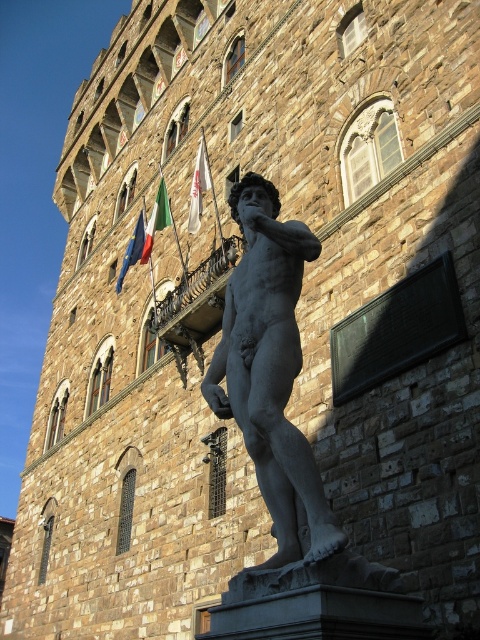
Question: Does green fabric flag at upper center come in front of blue fabric flag at upper left?

Choices:
 (A) no
 (B) yes

Answer: (B)

Question: Based on their relative distances, which object is farther from the white fabric flag at upper center?

Choices:
 (A) matte gray statue at center
 (B) green fabric flag at upper center

Answer: (A)

Question: Considering the real-world distances, which object is closest to the white fabric flag at upper center?

Choices:
 (A) green fabric flag at upper center
 (B) matte gray statue at center
 (C) blue fabric flag at upper left

Answer: (A)

Question: Where is matte gray statue at center located in relation to blue fabric flag at upper left in the image?

Choices:
 (A) below
 (B) above

Answer: (A)

Question: Is white fabric flag at upper center to the right of blue fabric flag at upper left from the viewer's perspective?

Choices:
 (A) yes
 (B) no

Answer: (A)

Question: Among these objects, which one is nearest to the camera?

Choices:
 (A) matte gray statue at center
 (B) green fabric flag at upper center
 (C) white fabric flag at upper center

Answer: (A)